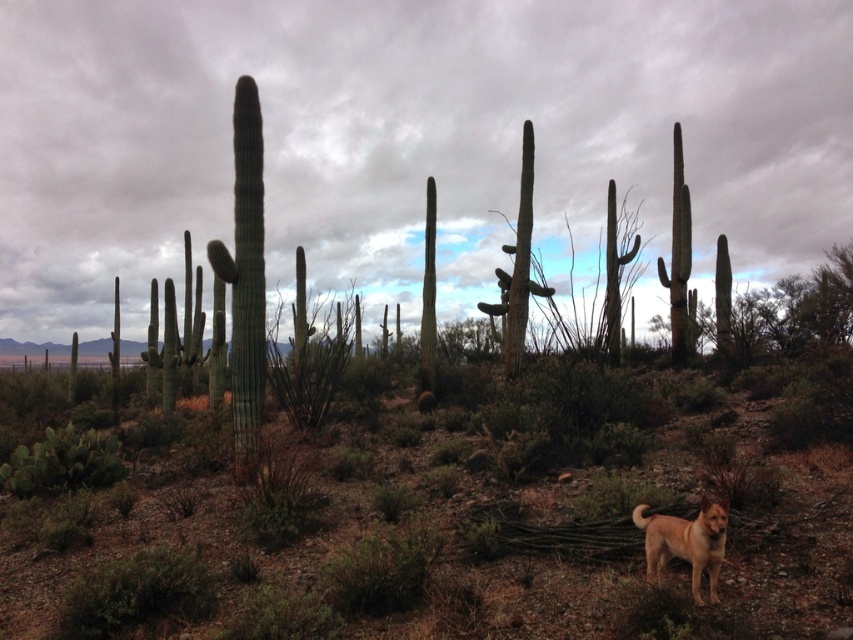
Is green matte cactus at center to the right of golden fur dog at lower right from the viewer's perspective?

Answer: No, green matte cactus at center is not to the right of golden fur dog at lower right.

Is green matte cactus at center wider than golden fur dog at lower right?

Correct, the width of green matte cactus at center exceeds that of golden fur dog at lower right.

Which is in front, point (415, 570) or point (691, 529)?

Point (691, 529) is more forward.

Image resolution: width=853 pixels, height=640 pixels. In order to click on green matte cactus at center in this screenshot , I will do `click(416, 540)`.